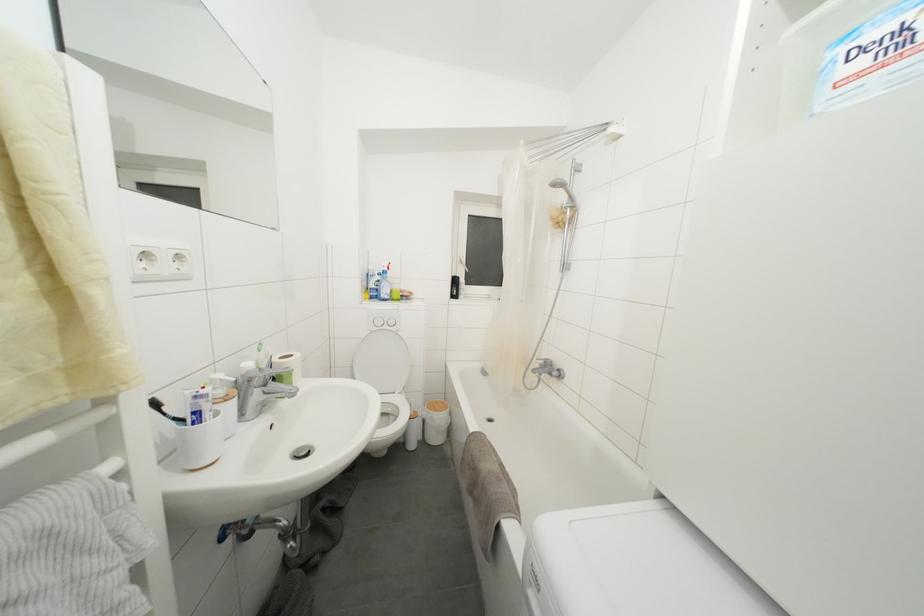
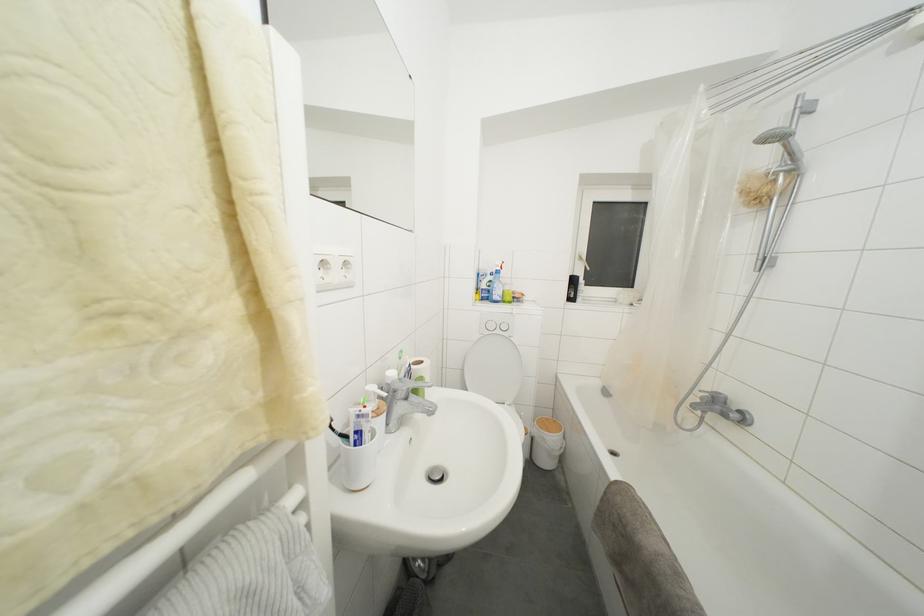
Where in the second image is the point corresponding to (200,402) from the first image?

(362, 421)